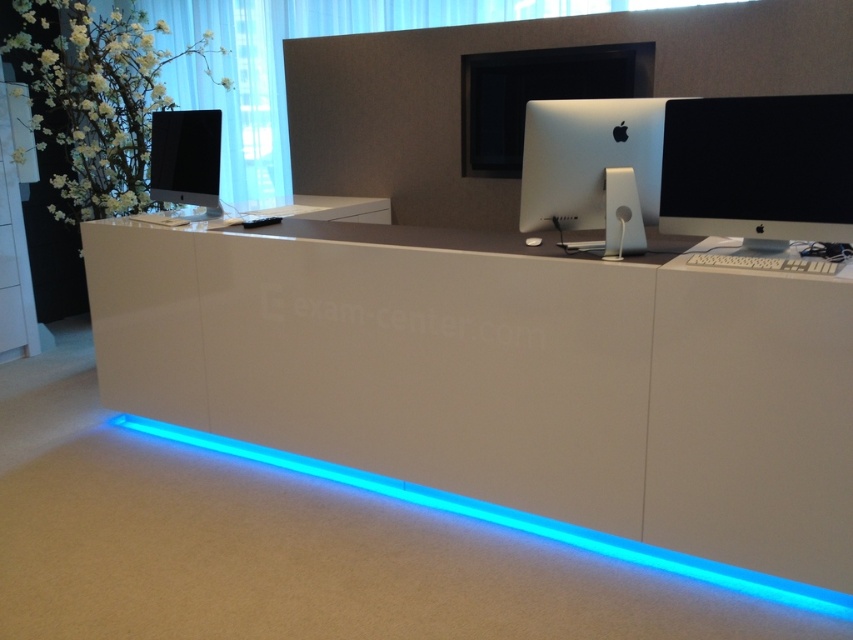
Does black glossy monitor at right appear over blue led strip at lower center?

Yes, black glossy monitor at right is above blue led strip at lower center.

Who is more forward, (x=685, y=147) or (x=422, y=486)?

Point (x=685, y=147) is more forward.

Locate an element on the screen. black glossy monitor at right is located at coordinates point(758,168).

Which is more to the left, black glossy monitor at right or matte black monitor at left?

matte black monitor at left

You are a GUI agent. You are given a task and a screenshot of the screen. Output one action in this format:
    pyautogui.click(x=<x>, y=<y>)
    Task: Click on the black glossy monitor at right
    Image resolution: width=853 pixels, height=640 pixels.
    Given the screenshot: What is the action you would take?
    pyautogui.click(x=758, y=168)

Measure the distance between sleek silver imac at center and camera.

2.23 meters

Can you confirm if sleek silver imac at center is positioned to the left of matte black monitor at left?

Incorrect, sleek silver imac at center is not on the left side of matte black monitor at left.

Which is behind, point (590, 154) or point (218, 196)?

The point (218, 196) is behind.

The image size is (853, 640). In order to click on sleek silver imac at center in this screenshot , I will do `click(587, 157)`.